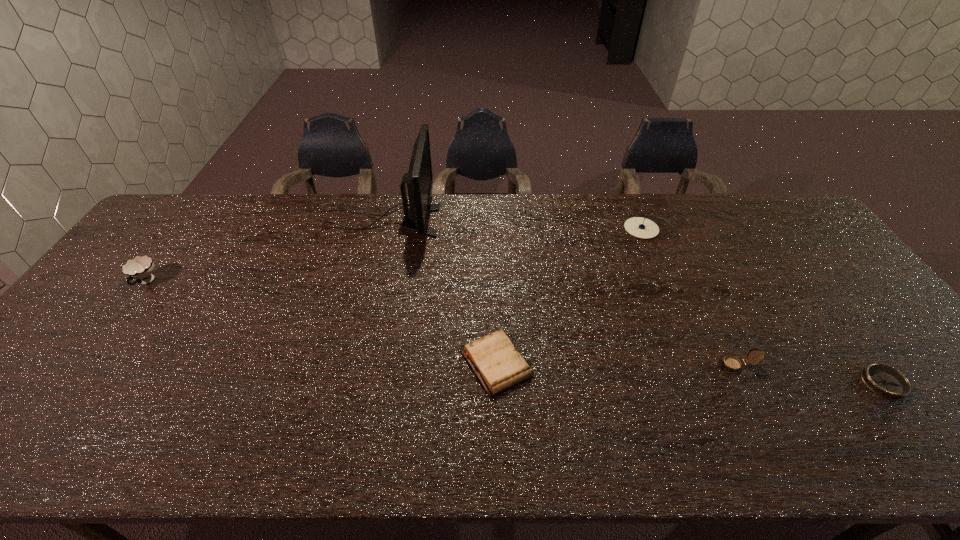
Locate an element on the screen. Image resolution: width=960 pixels, height=540 pixels. vacant area at the left edge of the desktop is located at coordinates (146, 290).

You are a GUI agent. You are given a task and a screenshot of the screen. Output one action in this format:
    pyautogui.click(x=<x>, y=<y>)
    Task: Click on the vacant space at the far left corner of the desktop
    
    Given the screenshot: What is the action you would take?
    pyautogui.click(x=215, y=199)

This screenshot has width=960, height=540. Find the location of `free space at the far right corner`. free space at the far right corner is located at coordinates (766, 225).

Where is `vacant region between the second shortest object and the fifth object from right to left`? vacant region between the second shortest object and the fifth object from right to left is located at coordinates (440, 292).

Identify the location of vacant space in between the cup and the shortest compass. This screenshot has height=540, width=960. (515, 333).

At what (x,y) coordinates should I click in order to perform the action: click on unoccupied position between the computer monitor and the cup. Please return your answer as a coordinate pair (x, y). This screenshot has height=540, width=960. Looking at the image, I should click on click(x=264, y=252).

Find the location of `vacant space that's between the shortest compass and the farthest compass`. vacant space that's between the shortest compass and the farthest compass is located at coordinates (762, 306).

Identify the location of vacant area that lies between the computer monitor and the third farthest object. The height and width of the screenshot is (540, 960). (264, 252).

I want to click on free space between the farthest compass and the second object from left to right, so click(x=512, y=225).

Identify the location of empty space that is in between the third object from left to right and the computer monitor. The width and height of the screenshot is (960, 540). (440, 292).